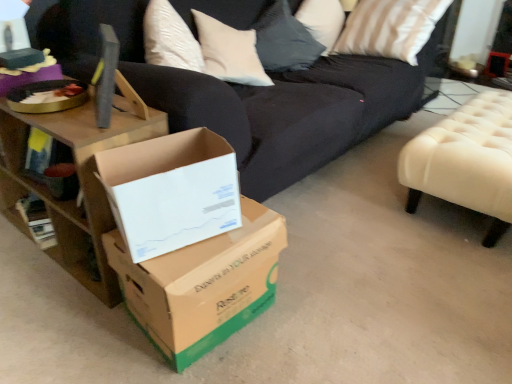
This screenshot has height=384, width=512. What do you see at coordinates (202, 284) in the screenshot?
I see `brown cardboard box at center, arranged as the 2th box when viewed from the top` at bounding box center [202, 284].

The image size is (512, 384). What are the coordinates of `metallic silver side table at upper right` in the screenshot? It's located at 450,94.

Locate an element on the screen. This screenshot has height=384, width=512. white tufted ottoman at right is located at coordinates (466, 161).

Find the location of `white cardboard box at center, which is the 2th box in bottom-to-top order`. white cardboard box at center, which is the 2th box in bottom-to-top order is located at coordinates (170, 190).

Does point (508, 132) appear closer or farther from the camera than point (164, 204)?

Point (508, 132) is farther from the camera than point (164, 204).

Is white tufted ottoman at right next to white cardboard box at center, which is the 2th box in bottom-to-top order?

They are not placed beside each other.

From a real-world perspective, which object stands above the other?

In real-world perspective, white cardboard box at center, which is the 2th box in bottom-to-top order, is above.

Could white cardboard box at center, which is the 2th box in bottom-to-top order, be considered to be inside white tufted ottoman at right?

No, white cardboard box at center, which is the 2th box in bottom-to-top order, is located outside of white tufted ottoman at right.

Is point (71, 231) farther from viewer compared to point (431, 83)?

That is False.

Is wooden table at left smaller than metallic silver side table at upper right?

Actually, wooden table at left might be larger than metallic silver side table at upper right.

From the image's perspective, is wooden table at left located above metallic silver side table at upper right?

No.

Does point (187, 148) lie behind point (453, 173)?

That is False.

This screenshot has height=384, width=512. In the image, there is a white cardboard box at center, which is the 2th box in bottom-to-top order. Identify the location of furniture below it (from a real-world perspective). (466, 161).

From a real-world perspective, is white cardboard box at center, placed as the first box when sorted from top to bottom, physically above white tufted ottoman at right?

Indeed, from a real-world perspective, white cardboard box at center, placed as the first box when sorted from top to bottom, stands above white tufted ottoman at right.

From the image's perspective, between metallic silver side table at upper right and wooden table at left, who is located below?

wooden table at left appears lower in the image.

How different are the orientations of metallic silver side table at upper right and wooden table at left in degrees?

The facing directions of metallic silver side table at upper right and wooden table at left are 0.907 degrees apart.

Which is farther, (440, 88) or (69, 215)?

Point (440, 88)

Is white cardboard box at center, which is the 2th box in bottom-to-top order, positioned with its back to metallic silver side table at upper right?

No, white cardboard box at center, which is the 2th box in bottom-to-top order, is not facing away from metallic silver side table at upper right.

Between point (118, 185) and point (455, 81), which one is positioned behind?

The point (455, 81) is behind.

Based on the photo, between white cardboard box at center, placed as the first box when sorted from top to bottom, and metallic silver side table at upper right, which one has larger size?

metallic silver side table at upper right is bigger.

From the image's perspective, is white cardboard box at center, which is the 2th box in bottom-to-top order, under metallic silver side table at upper right?

Yes, from the image's perspective, white cardboard box at center, which is the 2th box in bottom-to-top order, is below metallic silver side table at upper right.

Is white cardboard box at center, which is the 2th box in bottom-to-top order, inside or outside of wooden table at left?

white cardboard box at center, which is the 2th box in bottom-to-top order, is not enclosed by wooden table at left.

Would you say white cardboard box at center, which is the 2th box in bottom-to-top order, is to the left or to the right of wooden table at left in the picture?

Clearly, white cardboard box at center, which is the 2th box in bottom-to-top order, is on the right of wooden table at left in the image.

From the image's perspective, relative to wooden table at left, is white cardboard box at center, placed as the first box when sorted from top to bottom, above or below?

From the image's perspective, white cardboard box at center, placed as the first box when sorted from top to bottom, appears below wooden table at left.

Can you tell me how much white cardboard box at center, placed as the first box when sorted from top to bottom, and wooden table at left differ in facing direction?

66 degrees separate the facing orientations of white cardboard box at center, placed as the first box when sorted from top to bottom, and wooden table at left.

From a real-world perspective, is metallic silver side table at upper right under white tufted ottoman at right?

Indeed, from a real-world perspective, metallic silver side table at upper right is positioned beneath white tufted ottoman at right.

Looking at this image, considering the positions of objects metallic silver side table at upper right and white tufted ottoman at right in the image provided, who is more to the left, metallic silver side table at upper right or white tufted ottoman at right?

white tufted ottoman at right.

Find the location of a particular element. side table above the white tufted ottoman at right (from the image's perspective) is located at coordinates (450, 94).

Does metallic silver side table at upper right have a smaller size compared to white tufted ottoman at right?

Yes, metallic silver side table at upper right is smaller than white tufted ottoman at right.

Identify the location of the 1st box below when counting from the white tufted ottoman at right (from the image's perspective). (170, 190).

Identify the location of table above the metallic silver side table at upper right (from a real-world perspective). (79, 182).

Which object lies further to the anchor point wooden table at left, brown cardboard box at center, arranged as the 2th box when viewed from the top, or white tufted ottoman at right?

The object further to wooden table at left is white tufted ottoman at right.

Looking at the image, which one is located closer to metallic silver side table at upper right, white cardboard box at center, placed as the first box when sorted from top to bottom, or white tufted ottoman at right?

Based on the image, white tufted ottoman at right appears to be nearer to metallic silver side table at upper right.

Looking at the image, which one is located closer to wooden table at left, white cardboard box at center, placed as the first box when sorted from top to bottom, or metallic silver side table at upper right?

white cardboard box at center, placed as the first box when sorted from top to bottom, is positioned closer to the anchor wooden table at left.

Looking at this image, considering their positions, is white tufted ottoman at right positioned further to white cardboard box at center, which is the 2th box in bottom-to-top order, than metallic silver side table at upper right?

Based on the image, metallic silver side table at upper right appears to be further to white cardboard box at center, which is the 2th box in bottom-to-top order.

When comparing their distances from wooden table at left, does metallic silver side table at upper right or brown cardboard box at center, which ranks as the first box in bottom-to-top order, seem closer?

brown cardboard box at center, which ranks as the first box in bottom-to-top order, is positioned closer to the anchor wooden table at left.

Which object lies nearer to the anchor point white cardboard box at center, which is the 2th box in bottom-to-top order, brown cardboard box at center, which ranks as the first box in bottom-to-top order, or metallic silver side table at upper right?

Among the two, brown cardboard box at center, which ranks as the first box in bottom-to-top order, is located nearer to white cardboard box at center, which is the 2th box in bottom-to-top order.

Which object lies nearer to the anchor point white tufted ottoman at right, metallic silver side table at upper right or white cardboard box at center, which is the 2th box in bottom-to-top order?

white cardboard box at center, which is the 2th box in bottom-to-top order, lies closer to white tufted ottoman at right than the other object.

Estimate the real-world distances between objects in this image. Which object is further from white cardboard box at center, placed as the first box when sorted from top to bottom, metallic silver side table at upper right or brown cardboard box at center, which ranks as the first box in bottom-to-top order?

metallic silver side table at upper right.

Image resolution: width=512 pixels, height=384 pixels. In order to click on box located between white cardboard box at center, placed as the first box when sorted from top to bottom, and metallic silver side table at upper right in the depth direction in this screenshot , I will do `click(202, 284)`.

Identify the location of furniture between wooden table at left and metallic silver side table at upper right in the horizontal direction. The width and height of the screenshot is (512, 384). (466, 161).

In order to click on box situated between white cardboard box at center, placed as the first box when sorted from top to bottom, and white tufted ottoman at right from left to right in this screenshot , I will do `click(202, 284)`.

Find the location of a particular element. furniture between white cardboard box at center, which is the 2th box in bottom-to-top order, and metallic silver side table at upper right from front to back is located at coordinates (466, 161).